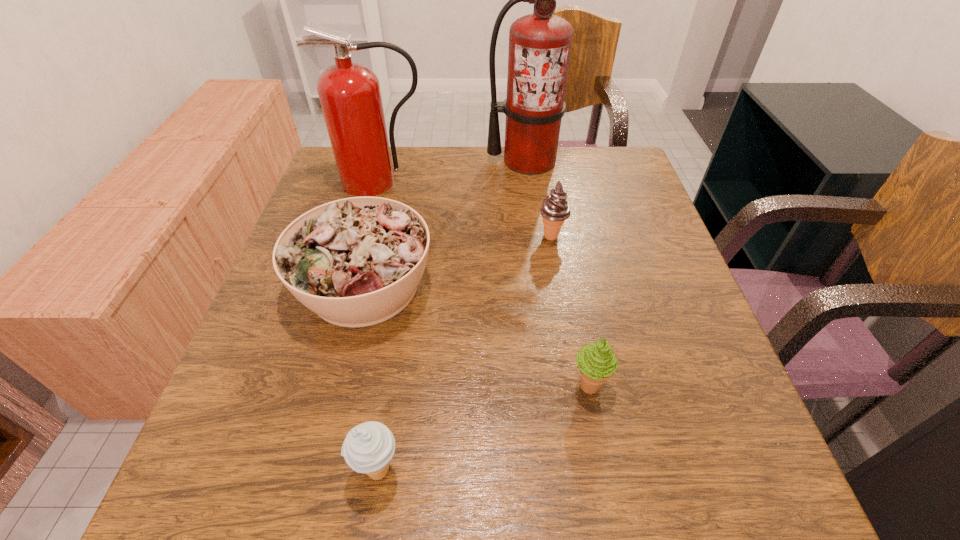
Identify the location of vacant space that's between the nearest object and the second farthest icecream. The width and height of the screenshot is (960, 540). (484, 428).

The width and height of the screenshot is (960, 540). Find the location of `empty space between the shorter fire extinguisher and the farthest icecream`. empty space between the shorter fire extinguisher and the farthest icecream is located at coordinates (467, 209).

Identify the location of unoccupied position between the fifth farthest object and the left fire extinguisher. This screenshot has width=960, height=540. (485, 284).

Image resolution: width=960 pixels, height=540 pixels. I want to click on object that can be found as the third closest to the farthest icecream, so 350,96.

What are the coordinates of `object identified as the third closest to the farthest icecream` in the screenshot? It's located at (350, 96).

At what (x,y) coordinates should I click in order to perform the action: click on icecream that can be found as the closest to the farthest icecream. Please return your answer as a coordinate pair (x, y). Looking at the image, I should click on (597, 363).

Where is `the closest icecream to the right fire extinguisher`? This screenshot has height=540, width=960. the closest icecream to the right fire extinguisher is located at coordinates (555, 209).

Where is `vacant space that satisfies the following two spatial constraints: 1. on the back side of the farthest icecream; 2. on the right side of the nearest object`? vacant space that satisfies the following two spatial constraints: 1. on the back side of the farthest icecream; 2. on the right side of the nearest object is located at coordinates click(415, 236).

You are a GUI agent. You are given a task and a screenshot of the screen. Output one action in this format:
    pyautogui.click(x=<x>, y=<y>)
    Task: Click on the vacant point that satisfies the following two spatial constraints: 1. toward the nozzle of the farthest icecream; 2. on the right side of the taller fire extinguisher
    This screenshot has height=540, width=960.
    Given the screenshot: What is the action you would take?
    pyautogui.click(x=538, y=236)

At what (x,y) coordinates should I click in order to perform the action: click on free region that satisfies the following two spatial constraints: 1. on the front side of the second nearest icecream; 2. on the left side of the farthest icecream. Please return your answer as a coordinate pair (x, y). This screenshot has height=540, width=960. Looking at the image, I should click on (578, 386).